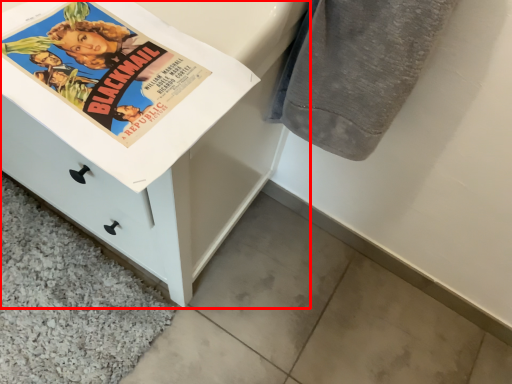
Question: From the image, what is the correct spatial relationship of chest of drawers (annotated by the red box) in relation to bath towel?

Choices:
 (A) right
 (B) left

Answer: (B)